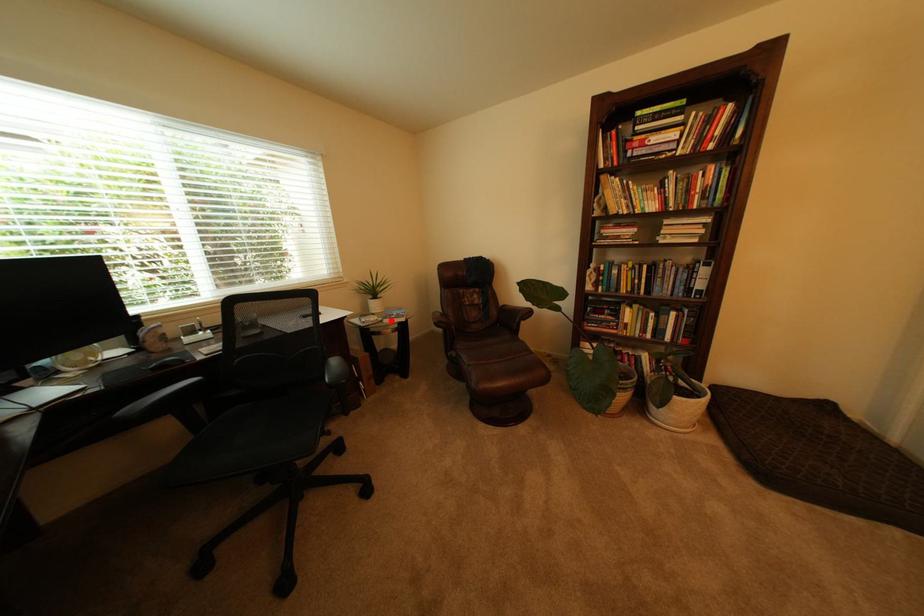
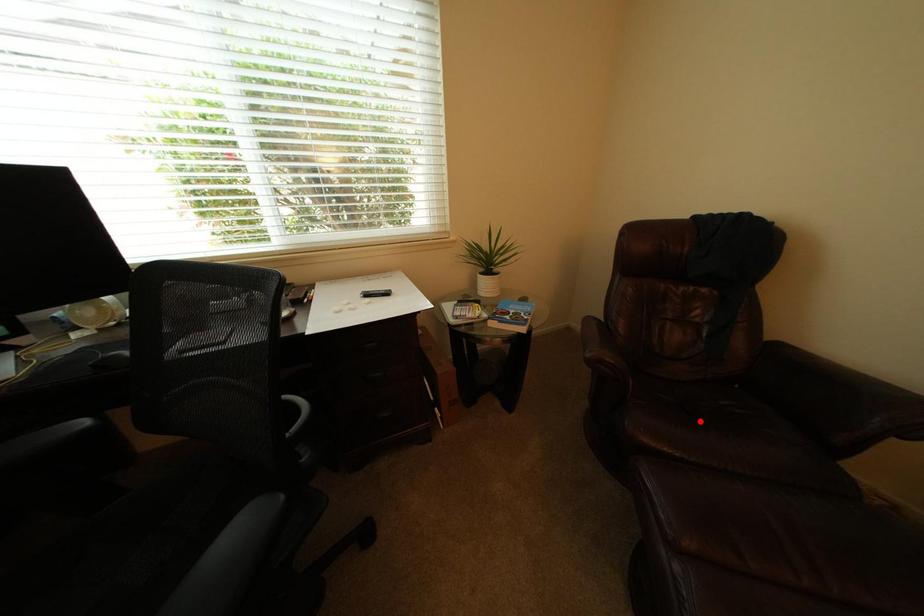
I am providing you with two images of the same scene from different viewpoints. A red point is marked on the first image and another point is marked on the second image. Are the points marked in image1 and image2 representing the same 3D position?

No